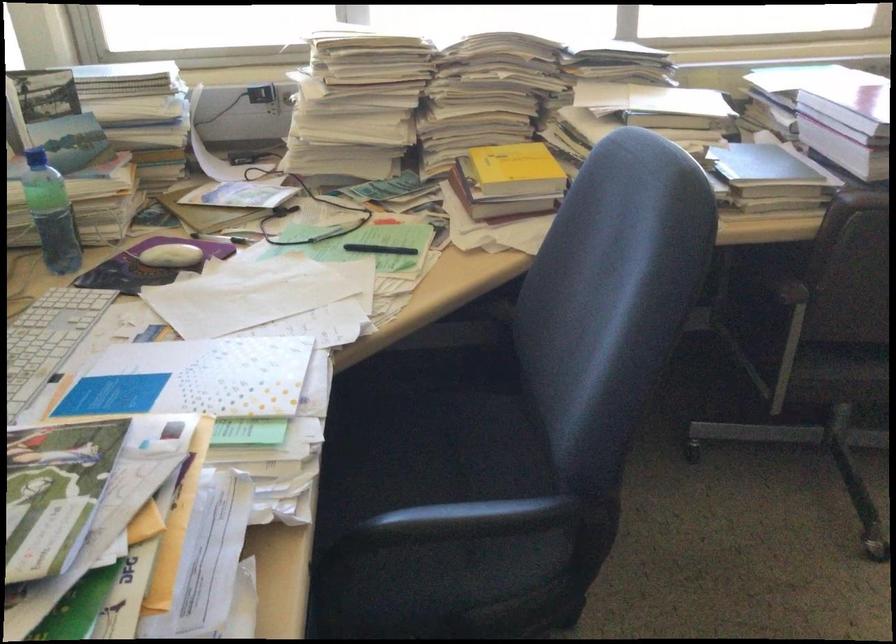
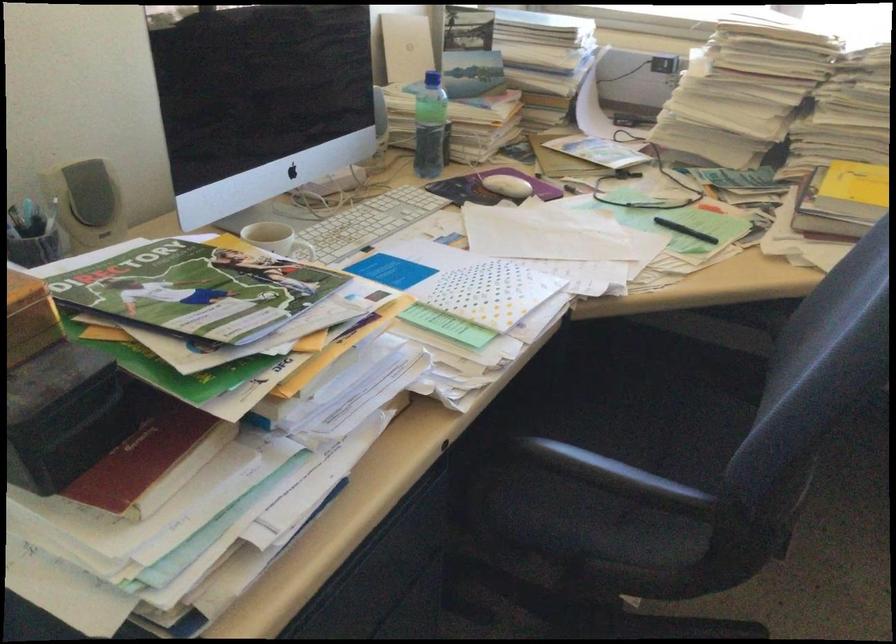
In the second image, find the point that corresponds to (380,249) in the first image.

(684, 230)